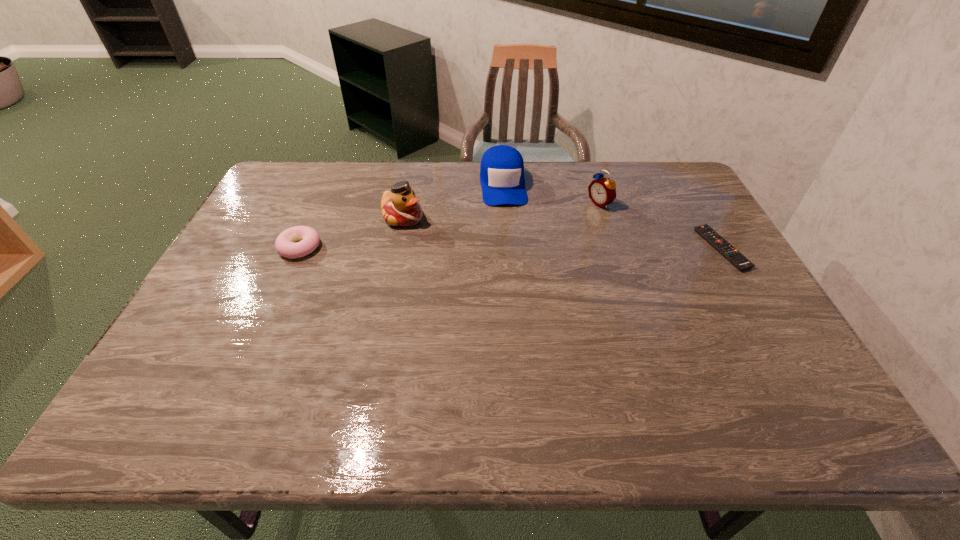
I want to click on vacant space that satisfies the following two spatial constraints: 1. on the back side of the fourth tallest object; 2. on the right side of the fourth object from right to left, so click(x=313, y=218).